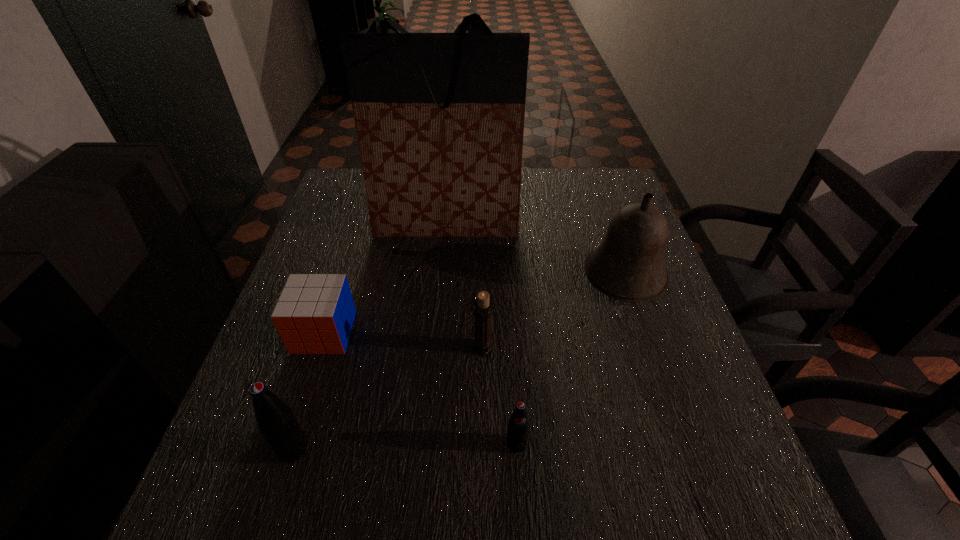
You are a GUI agent. You are given a task and a screenshot of the screen. Output one action in this format:
    pyautogui.click(x=<x>, y=<y>)
    Task: Click on the free spot between the taller pop and the rightmost object
    
    Given the screenshot: What is the action you would take?
    pyautogui.click(x=459, y=363)

Where is `vacant area that lies between the cube and the shorter pop`? Image resolution: width=960 pixels, height=540 pixels. vacant area that lies between the cube and the shorter pop is located at coordinates (420, 388).

The width and height of the screenshot is (960, 540). What are the coordinates of `unoccupied area between the candle holder and the taller pop` in the screenshot? It's located at (388, 398).

Identify the location of empty location between the rightmost object and the right pop. The image size is (960, 540). (570, 360).

Find the location of `free spot between the shorter pop and the candle holder`. free spot between the shorter pop and the candle holder is located at coordinates (500, 396).

You are a GUI agent. You are given a task and a screenshot of the screen. Output one action in this format:
    pyautogui.click(x=<x>, y=<y>)
    Task: Click on the object that can be found as the closest to the cube
    This screenshot has width=960, height=540.
    Given the screenshot: What is the action you would take?
    pyautogui.click(x=275, y=419)

This screenshot has height=540, width=960. I want to click on the third closest object relative to the farthest object, so click(483, 311).

Find the location of a particular element. The width and height of the screenshot is (960, 540). free region that satisfies the following two spatial constraints: 1. on the front-facing side of the farthest object; 2. on the front label of the taller pop is located at coordinates (426, 448).

This screenshot has width=960, height=540. Identify the location of vacant region that satisfies the following two spatial constraints: 1. on the back side of the cube; 2. on the left side of the rightmost object. (342, 277).

I want to click on free region that satisfies the following two spatial constraints: 1. on the front-facing side of the fourth tallest object; 2. on the left side of the farthest object, so click(x=435, y=348).